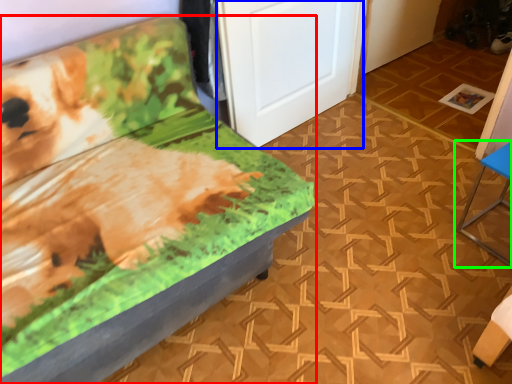
Question: Which object is positioned farthest from furniture (highlighted by a red box)? Select from door (highlighted by a blue box) and furniture (highlighted by a green box).

Choices:
 (A) door
 (B) furniture

Answer: (B)